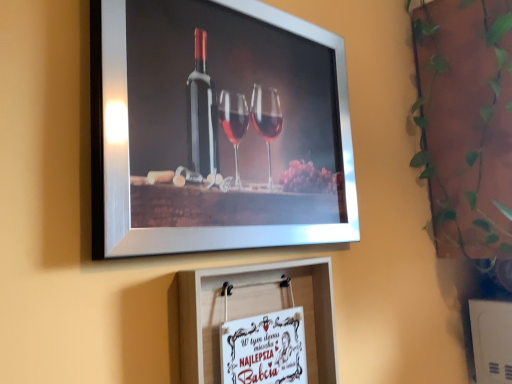
Question: Is metallic silver picture frame at upper center, placed as the second picture frame when sorted from bottom to top, in front of or behind white paper at center, arranged as the 2th picture frame when viewed from the top, in the image?

Choices:
 (A) front
 (B) behind

Answer: (A)

Question: From the image's perspective, is metallic silver picture frame at upper center, placed as the second picture frame when sorted from bottom to top, positioned above or below white paper at center, placed as the 1th picture frame when sorted from bottom to top?

Choices:
 (A) above
 (B) below

Answer: (A)

Question: Which object is the closest to the green leafy plant at upper right?

Choices:
 (A) metallic silver picture frame at upper center, the 1th picture frame from the top
 (B) white paper at center, placed as the 1th picture frame when sorted from bottom to top

Answer: (A)

Question: Which object is positioned closest to the metallic silver picture frame at upper center, the 1th picture frame from the top?

Choices:
 (A) green leafy plant at upper right
 (B) white paper at center, arranged as the 2th picture frame when viewed from the top

Answer: (B)